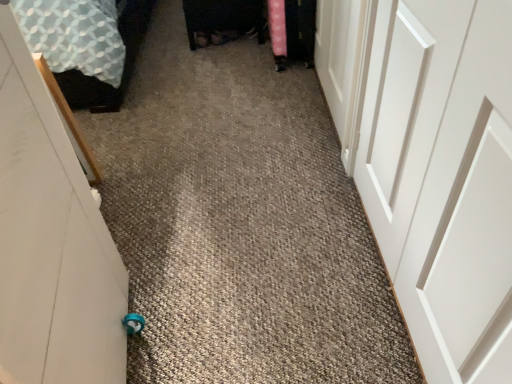
Identify the location of vacant area that lies between white matte door at upper right, positioned as the 2th door in right-to-left order, and white matte door at left, marked as the 3th door in a right-to-left arrangement. This screenshot has width=512, height=384. (250, 201).